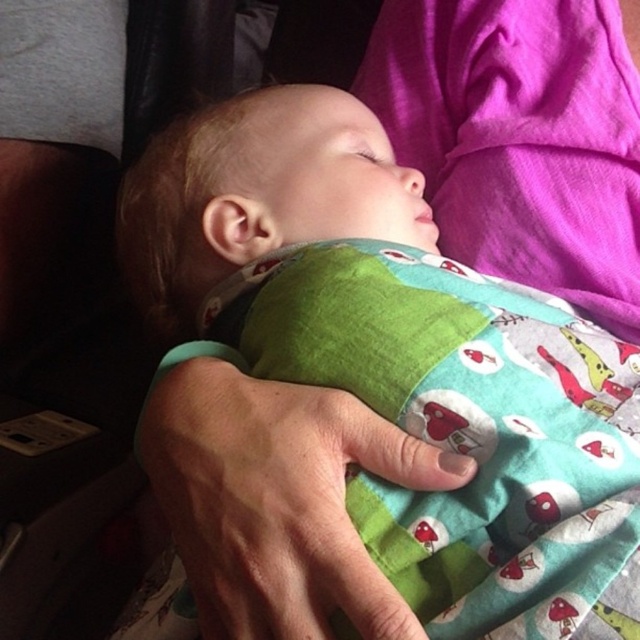
Looking at the image, there is a soft cotton baby at center and a green fabric at center. Which object is taller?

The soft cotton baby at center is taller than the green fabric at center.

You are a photographer setting up a studio for a baby photoshoot. The scene includes a soft cotton baby at center and a green fabric at center. You need to position a small prop between them. Based on their sizes, will the prop fit between them without overlapping either?

The soft cotton baby at center might be wider than green fabric at center, so the prop may not fit between them without overlapping if the distance between them is narrower than the prop size. However, without exact measurements, it is uncertain.

You are a photographer trying to capture the baby in the image. If you want to focus on the point closer to the camera, which point should you choose between point (460, 609) and point (200, 509)?

Point (460, 609) is in front of point (200, 509), so you should choose point (460, 609) to focus on the closer point.